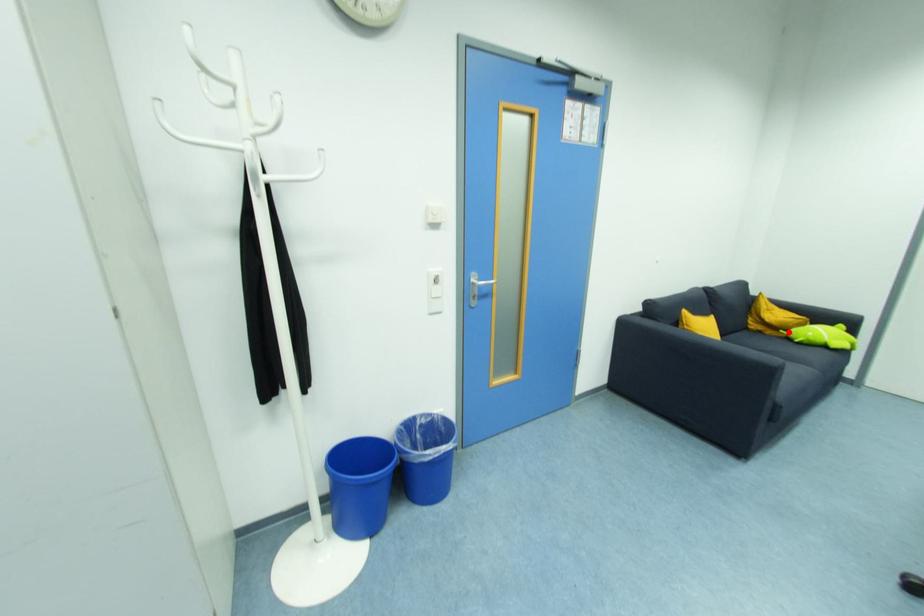
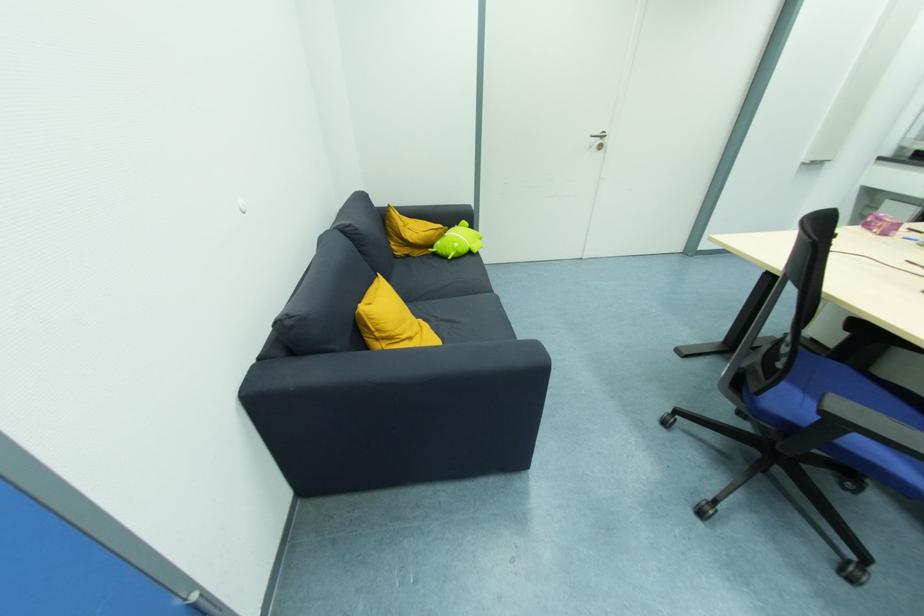
Question: I am providing you with two images of the same scene from different viewpoints. Image1 has a red point marked. In image2, the corresponding 3D location appears at what relative position? Reply with the corresponding letter.

Choices:
 (A) Closer
 (B) Farther

Answer: (A)